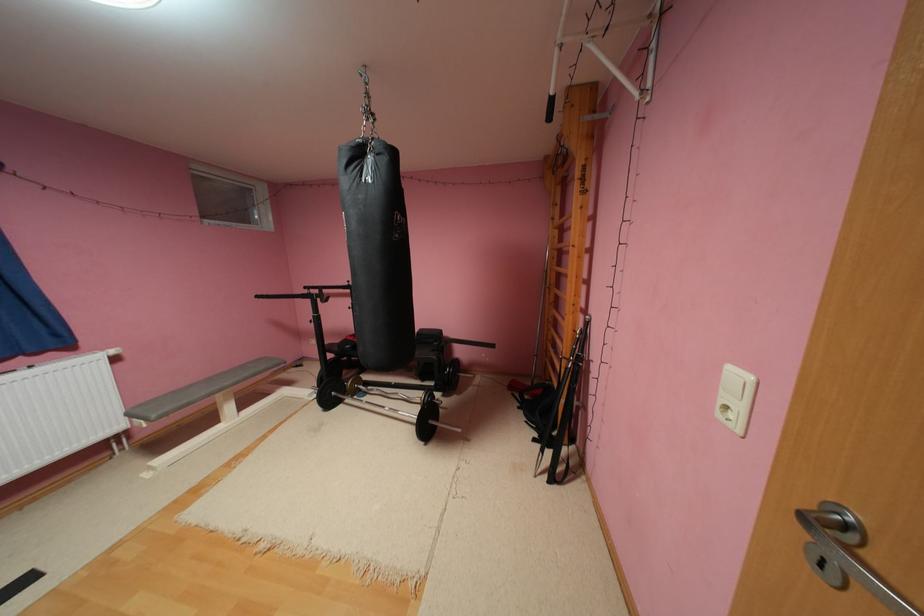
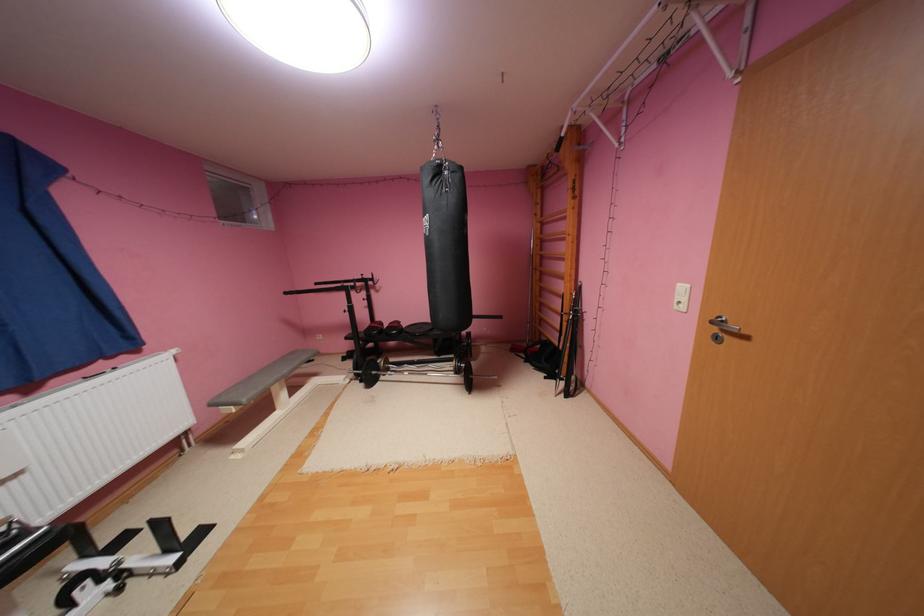
Where in the second image is the point corresponding to (561,92) from the first image?

(572, 135)